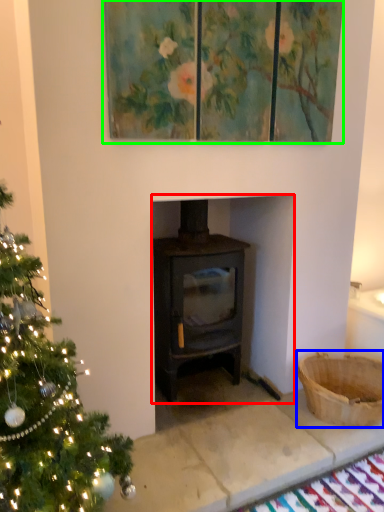
Question: Considering the real-world distances, which object is farthest from fireplace (highlighted by a red box)? basket (highlighted by a blue box) or oil painting (highlighted by a green box)?

Choices:
 (A) basket
 (B) oil painting

Answer: (B)